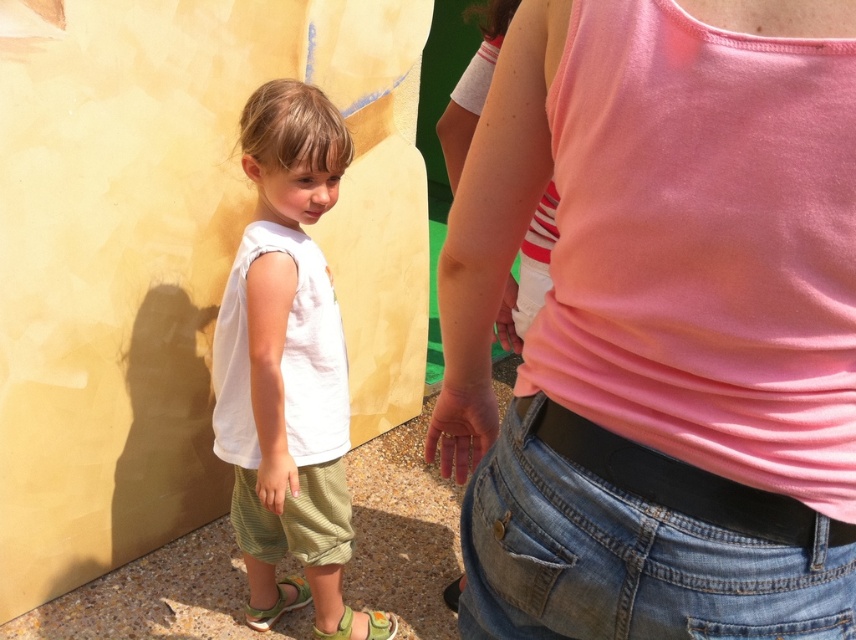
Is light green fabric sandal at lower left to the left of green fabric sandal at lower center from the viewer's perspective?

Indeed, light green fabric sandal at lower left is positioned on the left side of green fabric sandal at lower center.

Which is behind, point (302, 602) or point (391, 636)?

Positioned behind is point (302, 602).

Does point (310, 595) come farther from viewer compared to point (314, 637)?

That is True.

Identify the location of light green fabric sandal at lower left. The image size is (856, 640). (278, 604).

Between pink fabric tank top at upper center and white cotton shirt at center, which one appears on the right side from the viewer's perspective?

pink fabric tank top at upper center

Is point (611, 433) more distant than point (274, 392)?

No, (611, 433) is in front of (274, 392).

Locate an element on the screen. The width and height of the screenshot is (856, 640). pink fabric tank top at upper center is located at coordinates (660, 324).

The height and width of the screenshot is (640, 856). In order to click on white cotton shirt at center in this screenshot , I will do `click(286, 353)`.

Between white cotton shirt at center and light green fabric sandal at lower left, which one is positioned lower?

Positioned lower is light green fabric sandal at lower left.

Between point (241, 532) and point (278, 602), which one is positioned in front?

Point (241, 532) is more forward.

The width and height of the screenshot is (856, 640). Identify the location of white cotton shirt at center. pos(286,353).